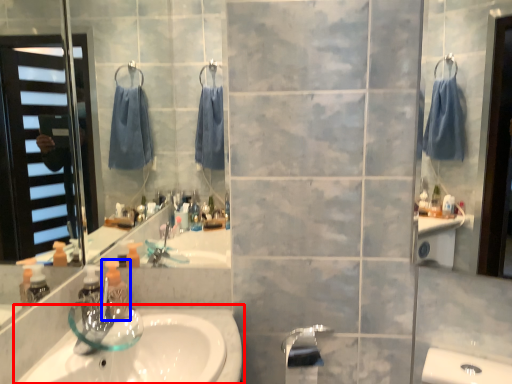
Question: Which object is closer to the camera taking this photo, sink (highlighted by a red box) or soap dispenser (highlighted by a blue box)?

Choices:
 (A) sink
 (B) soap dispenser

Answer: (A)